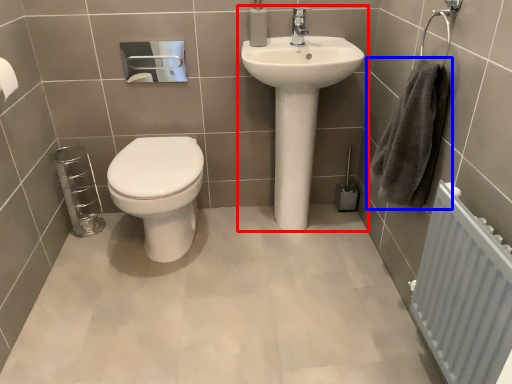
Question: Which object is closer to the camera taking this photo, sink (highlighted by a red box) or hand towel (highlighted by a blue box)?

Choices:
 (A) sink
 (B) hand towel

Answer: (B)